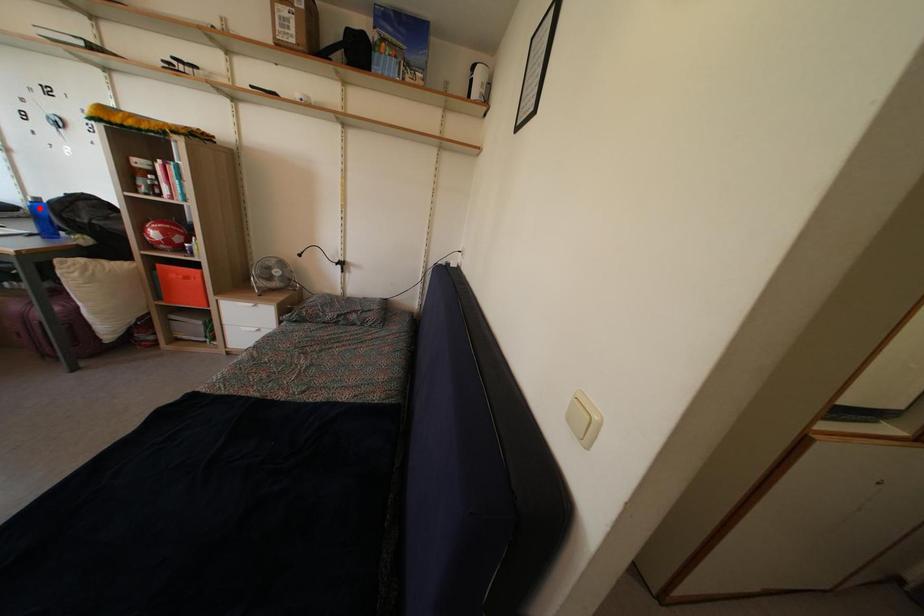
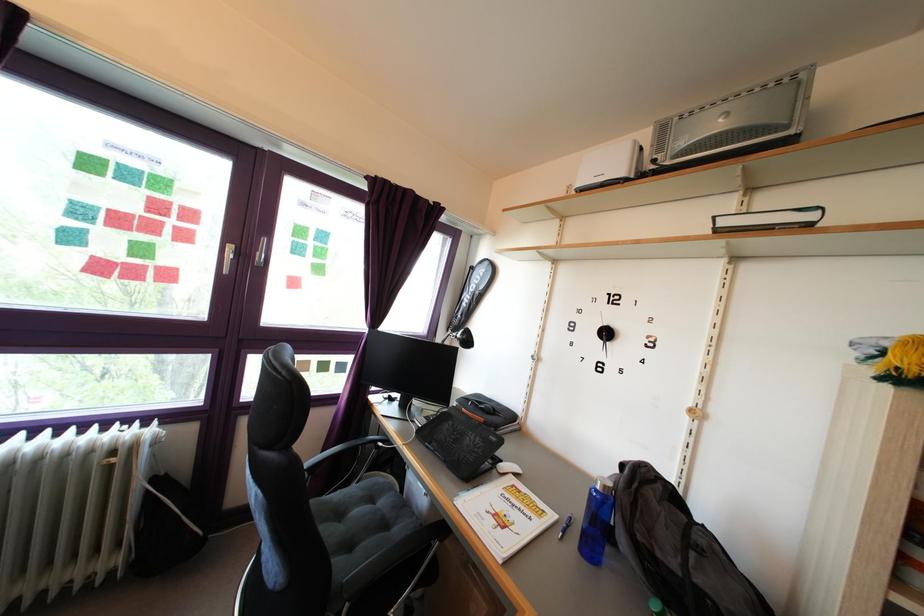
Question: I am providing you with two images of the same scene from different viewpoints. Image1 has a red point marked. In image2, the corresponding 3D location appears at what relative position? Reply with the corresponding letter.

Choices:
 (A) Closer
 (B) Farther

Answer: (A)